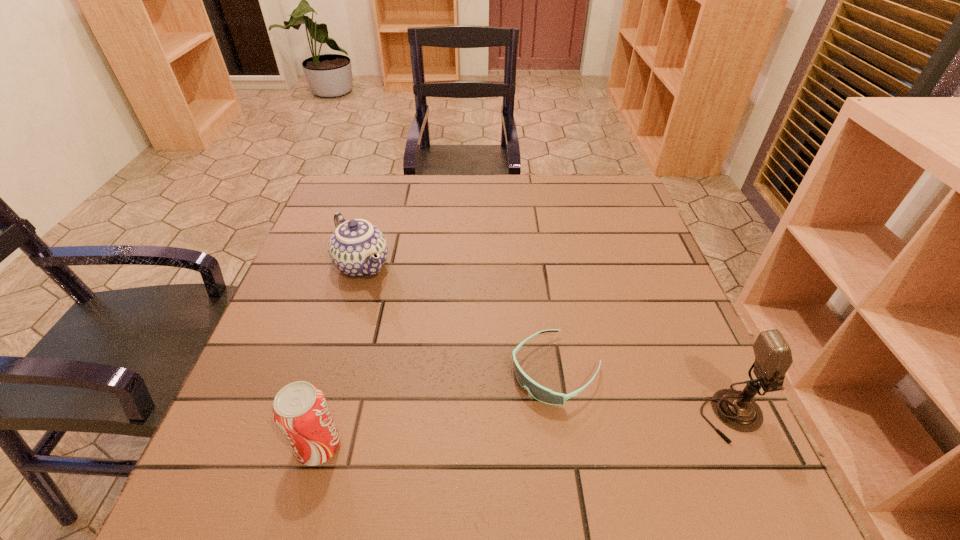
This screenshot has width=960, height=540. I want to click on free space in the image that satisfies the following two spatial constraints: 1. on the front side of the microphone; 2. on the front-facing side of the second object from right to left, so click(x=563, y=416).